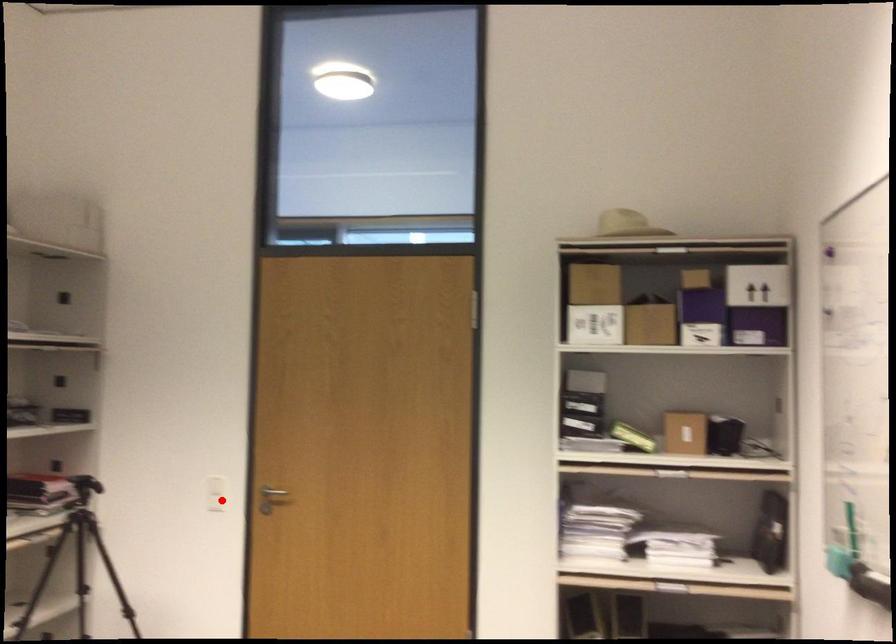
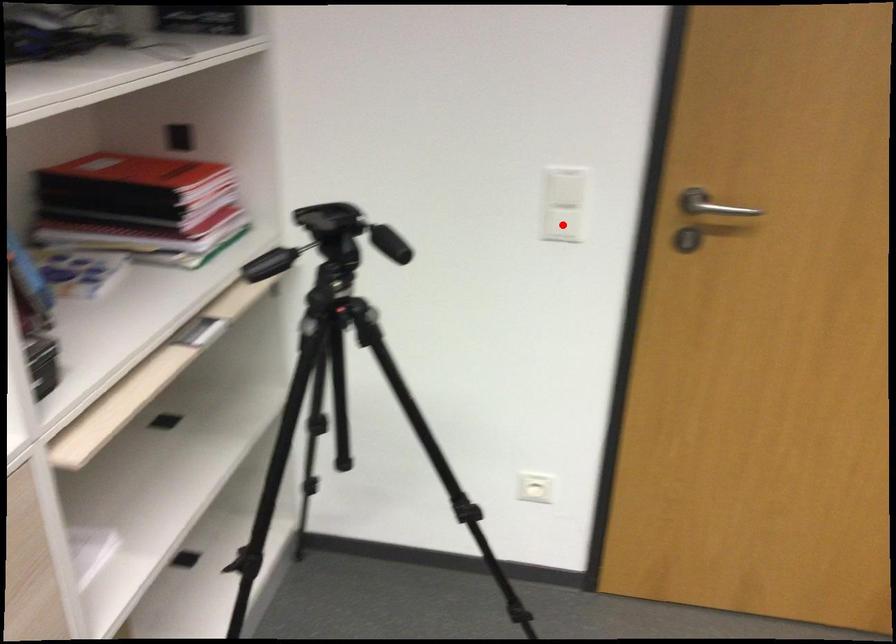
I am providing you with two images of the same scene from different viewpoints. A red point is marked on the first image and another point is marked on the second image. Is the marked point in image1 the same physical position as the marked point in image2?

Yes